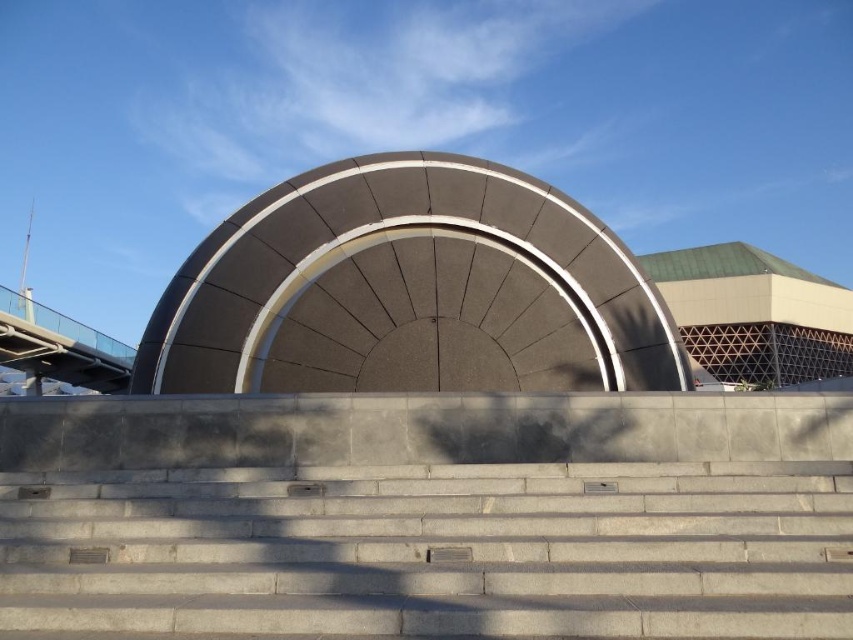
Question: Is gray concrete stairs at center to the left of metallic silver dome at upper right from the viewer's perspective?

Choices:
 (A) no
 (B) yes

Answer: (B)

Question: In this image, where is gray concrete stairs at center located relative to metallic silver dome at upper right?

Choices:
 (A) left
 (B) right

Answer: (A)

Question: Among these objects, which one is nearest to the camera?

Choices:
 (A) gray concrete stairs at center
 (B) metallic silver dome at upper right

Answer: (A)

Question: Does gray concrete stairs at center appear on the left side of metallic silver dome at upper right?

Choices:
 (A) yes
 (B) no

Answer: (A)